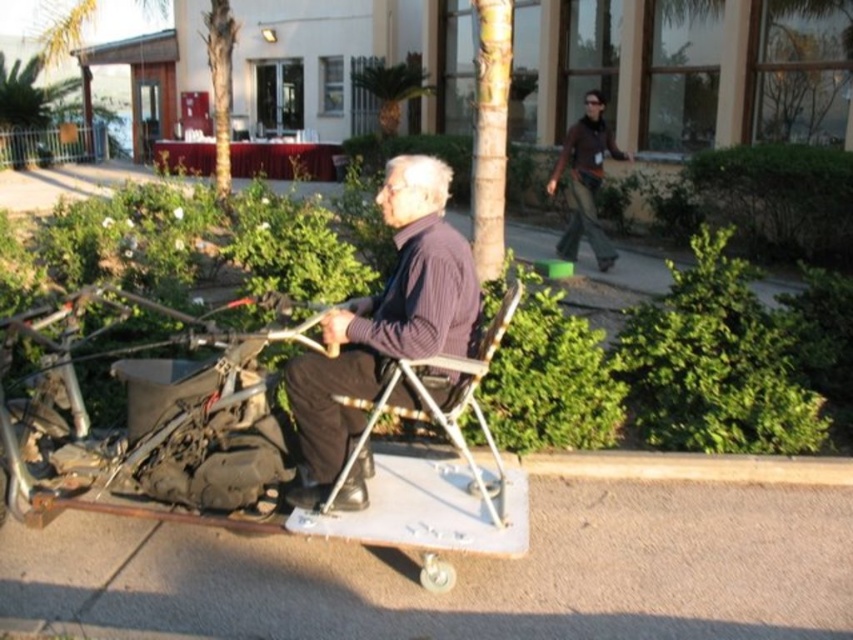
Which is more to the left, smooth light brown tree trunk at center or green leafy tree at upper center?

From the viewer's perspective, green leafy tree at upper center appears more on the left side.

Does smooth light brown tree trunk at center appear under green leafy tree at upper center?

Yes, smooth light brown tree trunk at center is below green leafy tree at upper center.

At what (x,y) coordinates should I click in order to perform the action: click on smooth light brown tree trunk at center. Please return your answer as a coordinate pair (x, y). Looking at the image, I should click on (490, 132).

Based on the photo, between gray concrete pavement at lower center and brown textured pants at upper right, which one has more height?

brown textured pants at upper right is taller.

Between gray concrete pavement at lower center and brown textured pants at upper right, which one appears on the left side from the viewer's perspective?

From the viewer's perspective, gray concrete pavement at lower center appears more on the left side.

Which is in front, point (9, 611) or point (579, 177)?

Point (9, 611)

You are a GUI agent. You are given a task and a screenshot of the screen. Output one action in this format:
    pyautogui.click(x=<x>, y=<y>)
    Task: Click on the gray concrete pavement at lower center
    
    Given the screenshot: What is the action you would take?
    pyautogui.click(x=469, y=572)

Which of these two, dark ribbed sweater at center or green leafy tree at upper center, stands taller?

Standing taller between the two is green leafy tree at upper center.

Between point (326, 332) and point (386, 131), which one is positioned behind?

Positioned behind is point (386, 131).

This screenshot has width=853, height=640. Identify the location of dark ribbed sweater at center. (386, 321).